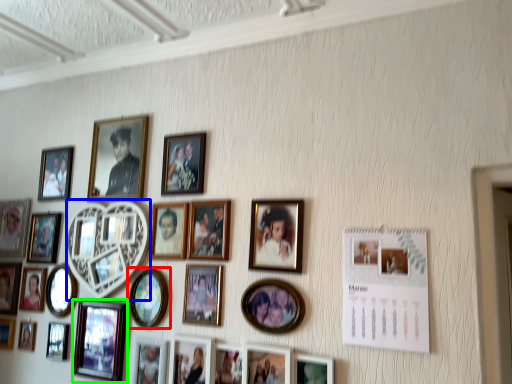
Question: Estimate the real-world distances between objects in this image. Which object is farther from picture frame (highlighted by a red box), picture frame (highlighted by a blue box) or picture frame (highlighted by a green box)?

Choices:
 (A) picture frame
 (B) picture frame

Answer: (A)